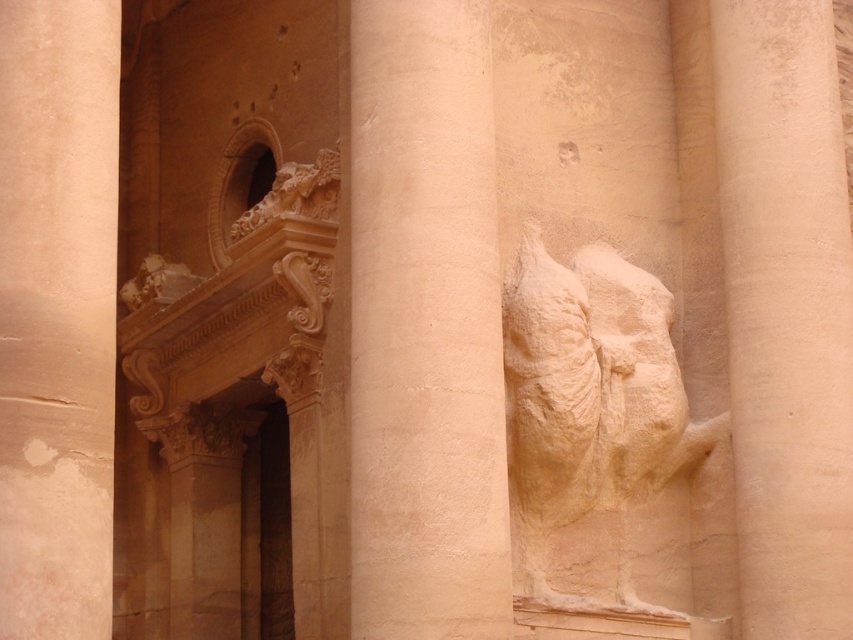
Question: Is smooth sandstone pillar at center to the left of beige stone relief at right from the viewer's perspective?

Choices:
 (A) yes
 (B) no

Answer: (A)

Question: Which of the following is the farthest from the observer?

Choices:
 (A) smooth sandstone pillar at center
 (B) beige stone relief at right

Answer: (B)

Question: Which of the following is the closest to the observer?

Choices:
 (A) beige stone relief at right
 (B) smooth sandstone pillar at center
 (C) smooth sandstone column at center
 (D) smooth sandstone column at right

Answer: (B)

Question: Which of the following is the farthest from the observer?

Choices:
 (A) (457, 236)
 (B) (788, 132)

Answer: (B)

Question: Can you confirm if smooth sandstone column at center is thinner than beige stone relief at right?

Choices:
 (A) no
 (B) yes

Answer: (B)

Question: Does smooth sandstone column at center appear on the right side of beige stone relief at right?

Choices:
 (A) no
 (B) yes

Answer: (A)